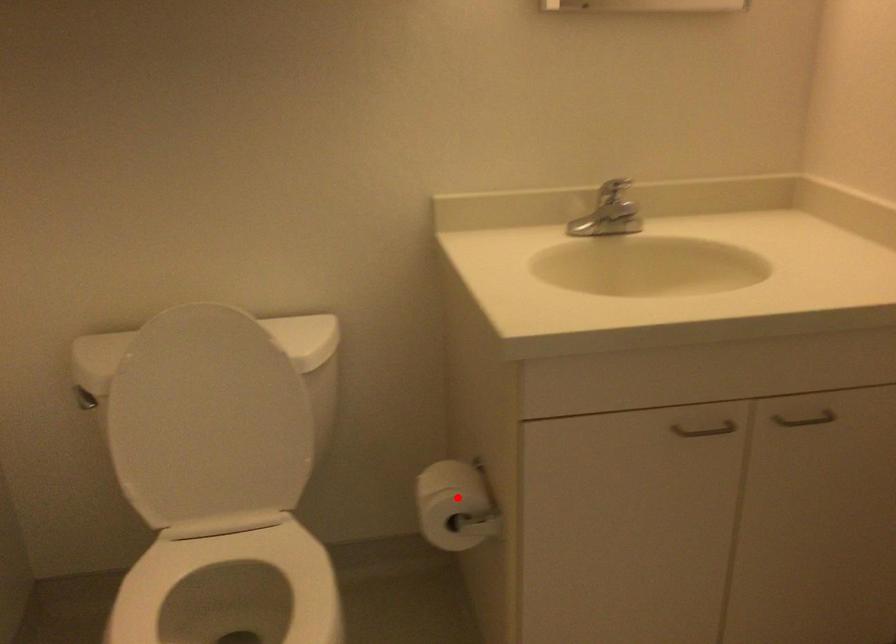
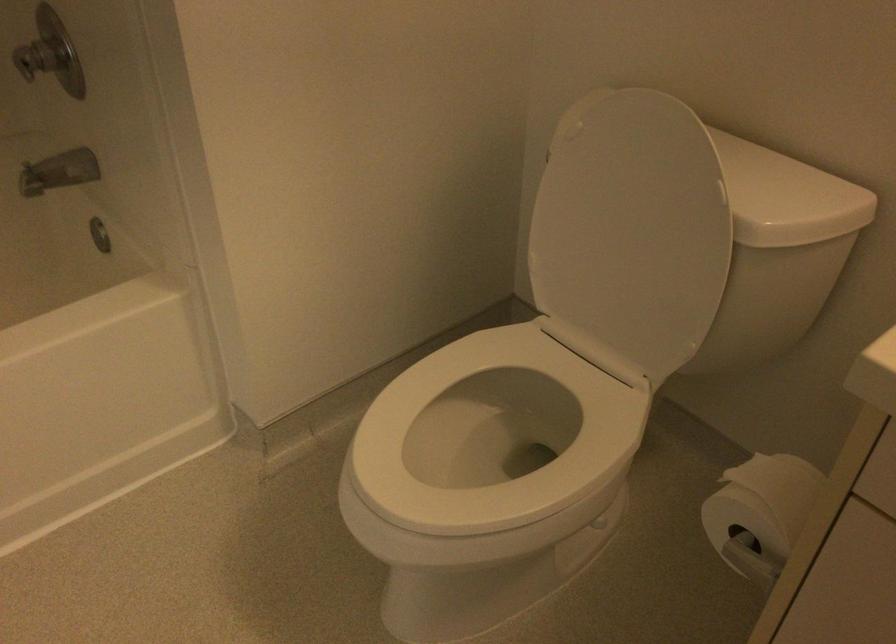
Question: I am providing you with two images of the same scene from different viewpoints. In image1, a red point is highlighted. Considering the same 3D point in image2, which of the following is correct?

Choices:
 (A) It is closer
 (B) It is farther

Answer: (A)